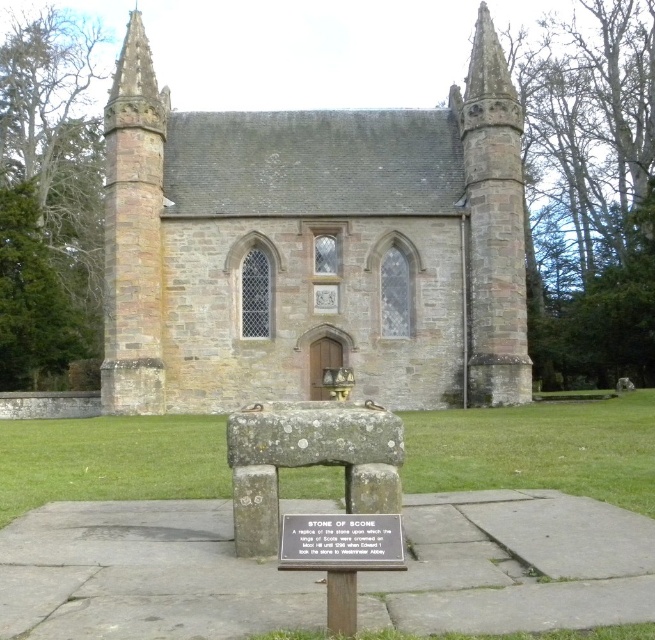
You are standing at the entrance of the historic stone structure and want to locate two specific points marked on the building. The first point is at coordinates point (107, 385) and the second is at point (318, 560). Which point is closer to the entrance?

Point (318, 560) is closer to the entrance because it is in front of point (107, 385).

You are standing in front of the historic stone structure. You see the brown stone church at center and the silver metallic plaque at center. Which object is positioned to the left?

The brown stone church at center is to the left of the silver metallic plaque at center.